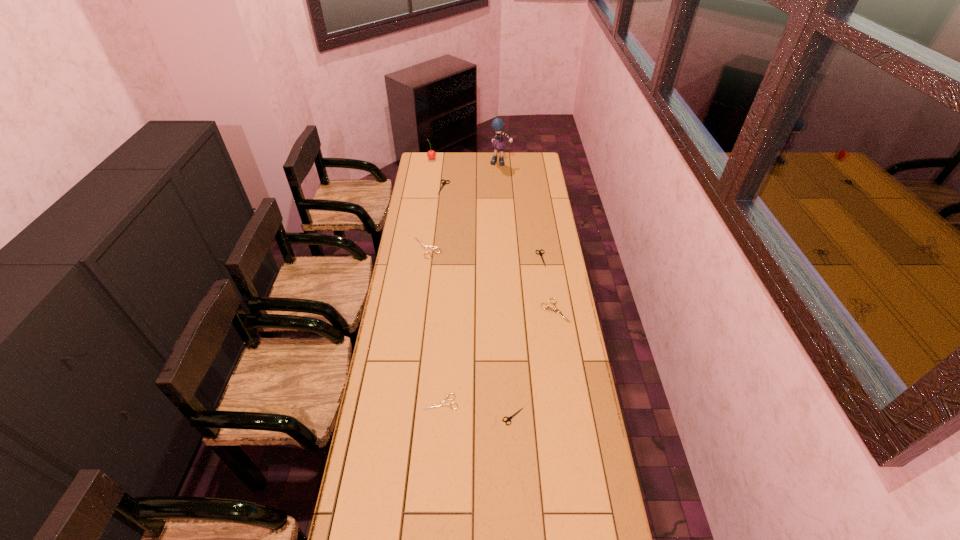
Locate an element on the screen. The height and width of the screenshot is (540, 960). the third nearest shears is located at coordinates (548, 308).

This screenshot has height=540, width=960. I want to click on the nearest beige shears, so click(441, 404).

Locate an element on the screen. This screenshot has height=540, width=960. the second black shears from left to right is located at coordinates (508, 418).

The image size is (960, 540). I want to click on the third shears from right to left, so tap(508, 418).

This screenshot has height=540, width=960. In order to click on vacant space located 0.080m on the front-facing side of the rag doll in this screenshot , I will do `click(501, 174)`.

The height and width of the screenshot is (540, 960). I want to click on free space located 0.260m on the front of the second tallest object, so click(x=428, y=185).

At what (x,y) coordinates should I click in order to perform the action: click on blank area located 0.150m on the back of the leftmost black shears. Please return your answer as a coordinate pair (x, y). The height and width of the screenshot is (540, 960). Looking at the image, I should click on (446, 166).

Where is `free space located 0.070m on the front of the farthest beige shears`? This screenshot has width=960, height=540. free space located 0.070m on the front of the farthest beige shears is located at coordinates (424, 269).

I want to click on vacant space located on the front of the second nearest black shears, so click(x=549, y=313).

Where is `free space located on the left of the second farthest beige shears`? This screenshot has width=960, height=540. free space located on the left of the second farthest beige shears is located at coordinates (x=490, y=311).